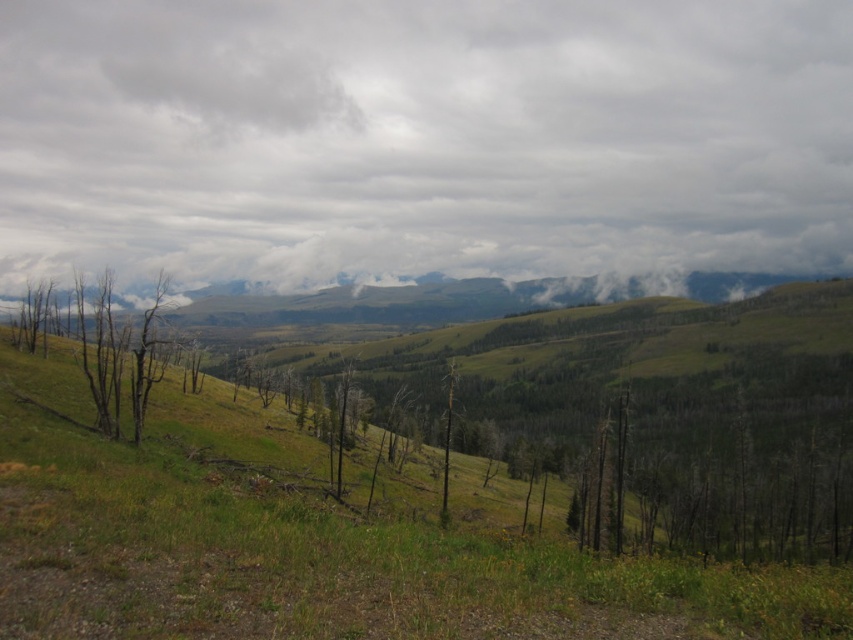
Is green grassy at center taller than brown dead wood at left?

Correct, green grassy at center is much taller as brown dead wood at left.

Is point (296, 458) positioned after point (107, 348)?

Yes.

Where is `green grassy at center`? The height and width of the screenshot is (640, 853). green grassy at center is located at coordinates (321, 540).

Is cloudy sky at upper center to the right of brown dead wood at left from the viewer's perspective?

Indeed, cloudy sky at upper center is positioned on the right side of brown dead wood at left.

Which is more to the left, cloudy sky at upper center or brown dead wood at left?

Positioned to the left is brown dead wood at left.

In order to click on cloudy sky at upper center in this screenshot , I will do `click(422, 138)`.

Is point (131, 77) positioned before point (309, 472)?

No, it is not.

Does cloudy sky at upper center have a larger size compared to green grassy at center?

Correct, cloudy sky at upper center is larger in size than green grassy at center.

Is point (647, 44) less distant than point (456, 454)?

No, it is behind (456, 454).

Locate an element on the screen. The width and height of the screenshot is (853, 640). cloudy sky at upper center is located at coordinates (422, 138).